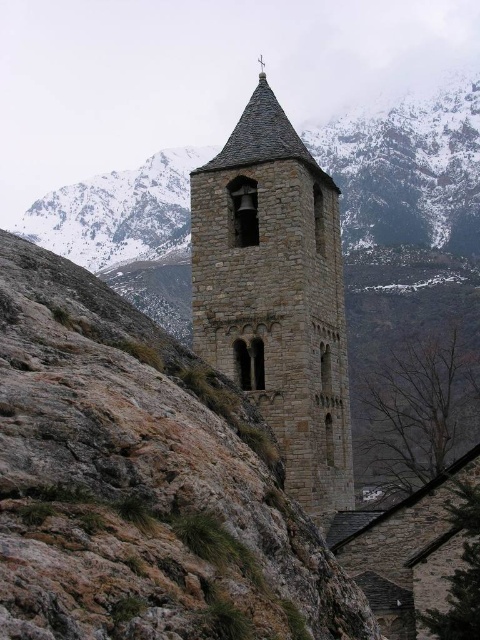
Who is more forward, (389, 323) or (204, 188)?

Positioned in front is point (204, 188).

Who is more forward, (359, 310) or (311, 499)?

Point (311, 499) is in front.

The height and width of the screenshot is (640, 480). What are the coordinates of `gray stone mountain at center` in the screenshot? It's located at (406, 228).